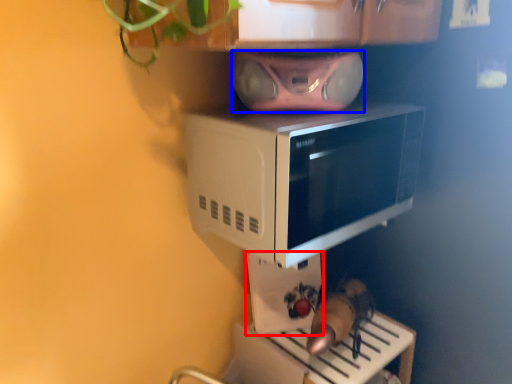
Question: Which of the following is the farthest to the observer, appliance (highlighted by a red box) or stereo (highlighted by a blue box)?

Choices:
 (A) appliance
 (B) stereo

Answer: (A)